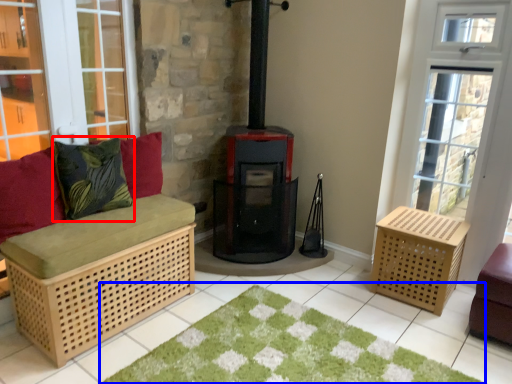
Question: Which point is further to the camera, pillow (highlighted by a red box) or doormat (highlighted by a blue box)?

Choices:
 (A) pillow
 (B) doormat

Answer: (A)